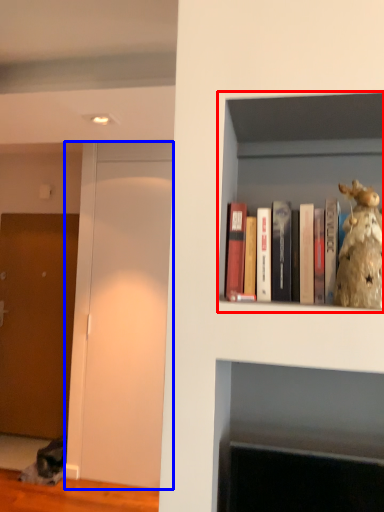
Question: Among these objects, which one is nearest to the camera, shelf (highlighted by a red box) or glass door (highlighted by a blue box)?

Choices:
 (A) shelf
 (B) glass door

Answer: (A)